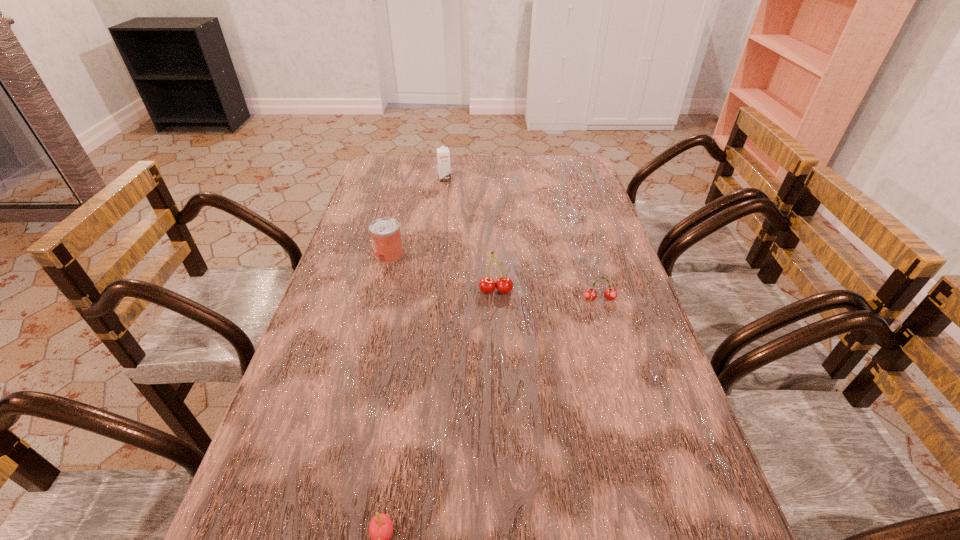
Find the location of a particular element. This screenshot has width=960, height=540. free region located with stems pointing upwards on the fourth tallest object is located at coordinates (624, 383).

This screenshot has width=960, height=540. In order to click on object that is at the far edge in this screenshot , I will do `click(443, 155)`.

You are a GUI agent. You are given a task and a screenshot of the screen. Output one action in this format:
    pyautogui.click(x=<x>, y=<y>)
    Task: Click on the object that is at the left edge
    
    Given the screenshot: What is the action you would take?
    pyautogui.click(x=385, y=234)

Find the location of a particular element. This screenshot has width=960, height=540. object at the right edge is located at coordinates (590, 294).

You are a GUI agent. You are given a task and a screenshot of the screen. Output one action in this format:
    pyautogui.click(x=<x>, y=<y>)
    Task: Click on the vacant space at the left edge of the desktop
    This screenshot has width=960, height=540.
    Given the screenshot: What is the action you would take?
    pyautogui.click(x=350, y=237)

In the image, there is a desktop. Where is `free space at the right edge`? free space at the right edge is located at coordinates (593, 186).

Locate an element on the screen. The image size is (960, 540). vacant area at the far left corner of the desktop is located at coordinates tap(396, 171).

You are a GUI agent. You are given a task and a screenshot of the screen. Output one action in this format:
    pyautogui.click(x=<x>, y=<y>)
    Task: Click on the free space at the far right corner of the desktop
    This screenshot has width=960, height=540.
    Given the screenshot: What is the action you would take?
    pyautogui.click(x=571, y=164)

Where is `free spot between the fourth object from left to right and the chocolate milk`? The image size is (960, 540). free spot between the fourth object from left to right and the chocolate milk is located at coordinates (470, 235).

The image size is (960, 540). In order to click on free spot between the second farthest object and the second cherry from left to right in this screenshot , I will do `click(443, 273)`.